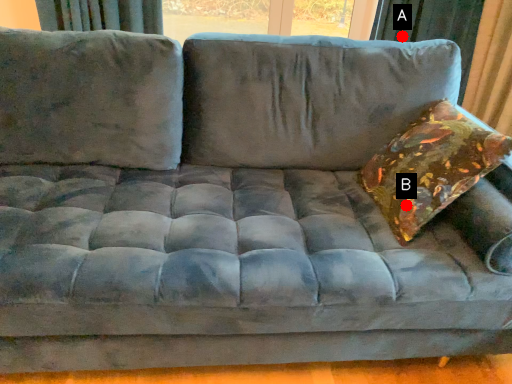
Question: Two points are circled on the image, labeled by A and B beside each circle. Which point is closer to the camera?

Choices:
 (A) A is closer
 (B) B is closer

Answer: (B)